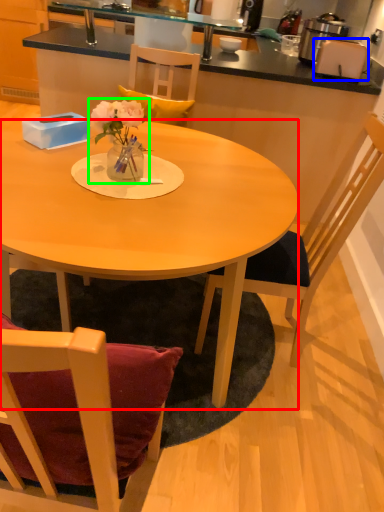
Question: Estimate the real-world distances between objects in this image. Which object is closer to desk (highlighted by a red box), toaster (highlighted by a blue box) or floral arrangement (highlighted by a green box)?

Choices:
 (A) toaster
 (B) floral arrangement

Answer: (B)